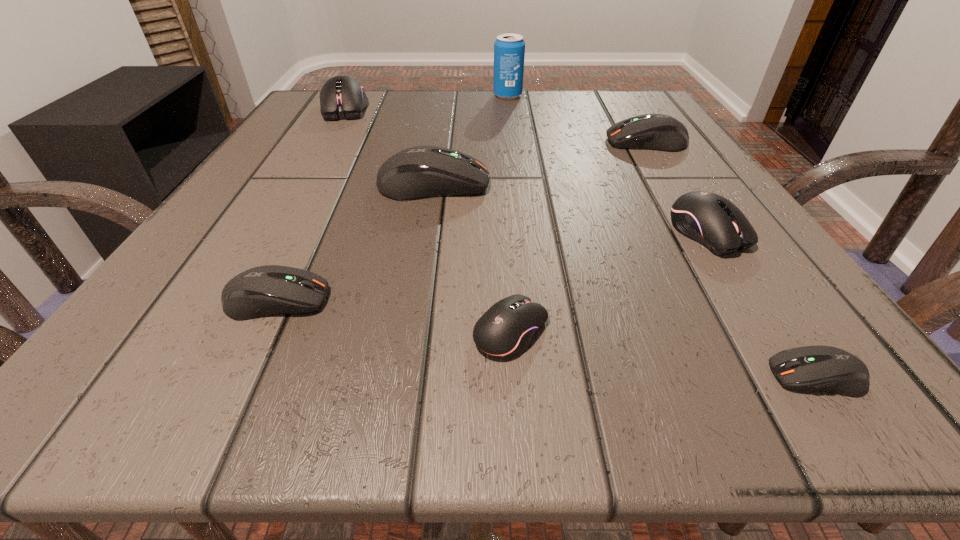
Find the location of a particular element. object that is at the far right corner is located at coordinates (659, 132).

You are a GUI agent. You are given a task and a screenshot of the screen. Output one action in this format:
    pyautogui.click(x=<x>, y=<y>)
    Task: Click on the object that is at the near right corner
    
    Given the screenshot: What is the action you would take?
    pyautogui.click(x=820, y=368)

Locate an element on the screen. This screenshot has height=540, width=960. free spot at the far edge of the desktop is located at coordinates (497, 123).

This screenshot has width=960, height=540. In the image, there is a desktop. Identify the location of vacant space at the near edge. (500, 376).

In the image, there is a desktop. Find the location of `vacant space at the left edge`. vacant space at the left edge is located at coordinates (241, 252).

The image size is (960, 540). What are the coordinates of `blank space at the right edge of the desktop` in the screenshot? It's located at (674, 298).

Where is `vacant space at the far right corner of the desktop`? This screenshot has height=540, width=960. vacant space at the far right corner of the desktop is located at coordinates (631, 111).

Locate an element on the screen. free region at the near right corner of the desktop is located at coordinates (819, 343).

Where is `free space between the farthest black computer mouse and the shortest object`? free space between the farthest black computer mouse and the shortest object is located at coordinates (581, 242).

What are the coordinates of `vacant space in between the second nearest dark computer equipment and the third dark computer equipment from right to left` in the screenshot? It's located at (355, 242).